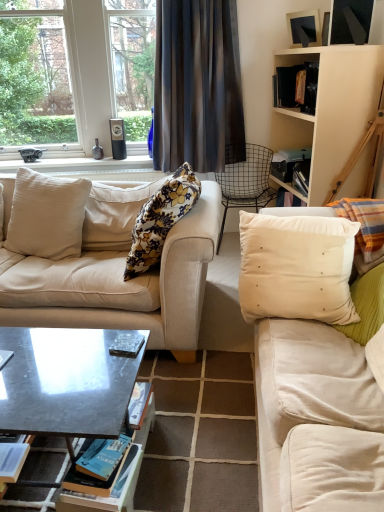
Identify the location of vacant space that's between wooden book at center, which is the 1th book from right to left, and metallic gray book at center, marked as the 2th book in a bottom-to-top arrangement. (54, 359).